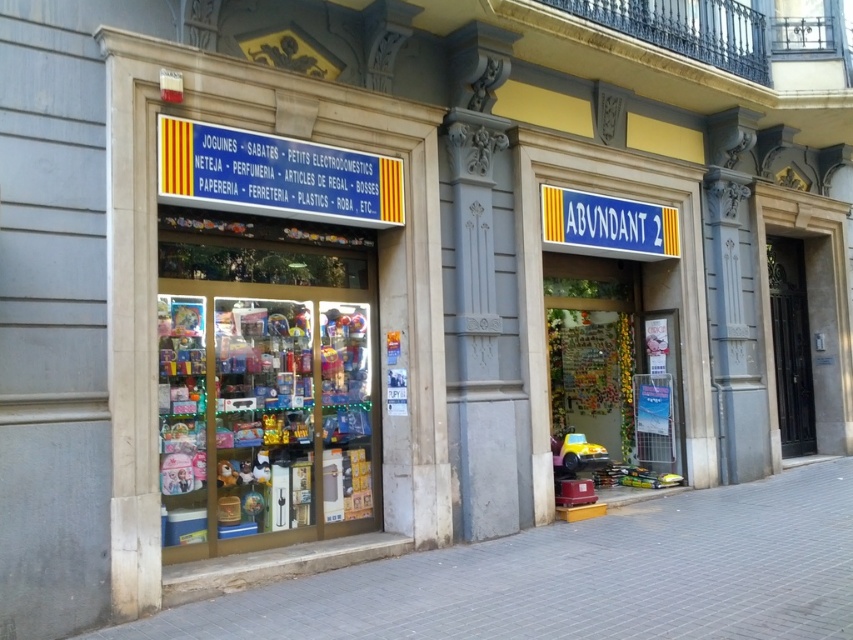
Question: Where is gray concrete pavement at lower left located in relation to blue plastic sign at upper center in the image?

Choices:
 (A) right
 (B) left

Answer: (B)

Question: Which is nearer to the gray concrete pavement at lower left?

Choices:
 (A) yellow fabric sign at upper center
 (B) blue plastic sign at upper center

Answer: (A)

Question: Does gray concrete pavement at lower left lie in front of blue plastic sign at upper center?

Choices:
 (A) no
 (B) yes

Answer: (B)

Question: In this image, where is yellow fabric sign at upper center located relative to blue plastic sign at upper center?

Choices:
 (A) above
 (B) below

Answer: (A)

Question: Which point is farther to the camera?

Choices:
 (A) (653, 205)
 (B) (814, 602)
 (C) (201, 125)

Answer: (A)

Question: Which of these objects is positioned closest to the yellow fabric sign at upper center?

Choices:
 (A) gray concrete pavement at lower left
 (B) blue plastic sign at upper center

Answer: (B)